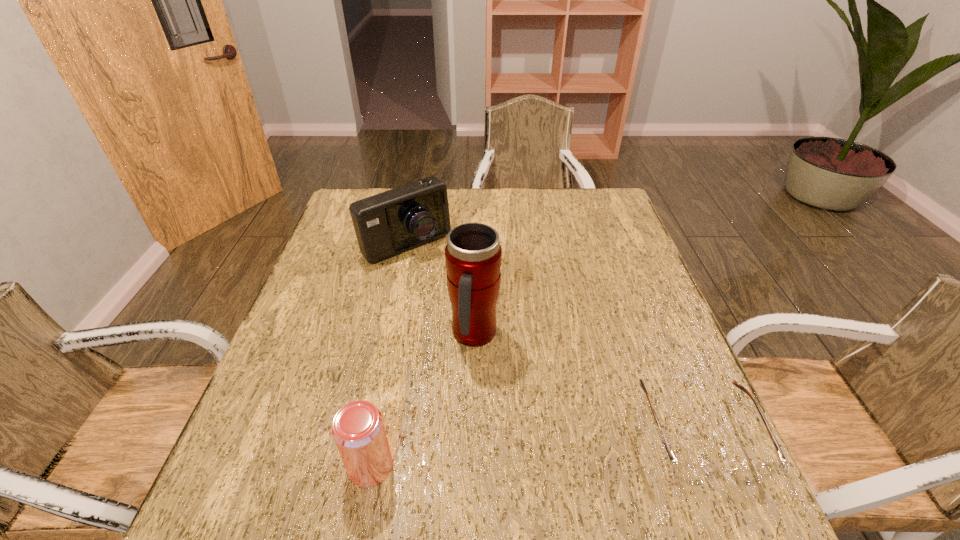
This screenshot has height=540, width=960. Find the location of `object that is at the near right corner`. object that is at the near right corner is located at coordinates (691, 473).

This screenshot has height=540, width=960. What are the coordinates of `vacant space at the far edge of the desktop` in the screenshot? It's located at [468, 219].

In the image, there is a desktop. Identify the location of vacant space at the near edge. Image resolution: width=960 pixels, height=540 pixels. (405, 439).

Image resolution: width=960 pixels, height=540 pixels. I want to click on free region at the left edge of the desktop, so click(331, 232).

At what (x,y) coordinates should I click in order to perform the action: click on free location at the right edge. Please return your answer as a coordinate pair (x, y). Looking at the image, I should click on (639, 285).

The image size is (960, 540). Find the location of `vacant area that lies between the beer can and the farthest object`. vacant area that lies between the beer can and the farthest object is located at coordinates (389, 355).

The width and height of the screenshot is (960, 540). I want to click on free space that is in between the thermos bottle and the shortest object, so click(x=588, y=384).

The image size is (960, 540). Identify the location of unoccupied position between the tallest object and the shortest object. (588, 384).

Image resolution: width=960 pixels, height=540 pixels. What are the coordinates of `free space between the shortest object and the third shortest object` in the screenshot? It's located at pos(553,339).

At what (x,y) coordinates should I click in order to perform the action: click on free point between the third nearest object and the second shortest object. Please return your answer as a coordinate pair (x, y). Looking at the image, I should click on (422, 401).